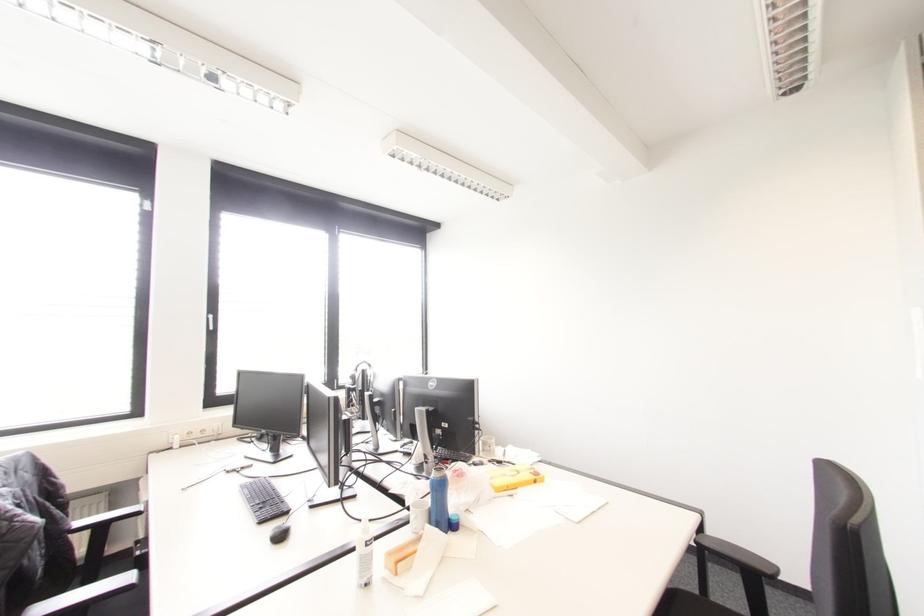
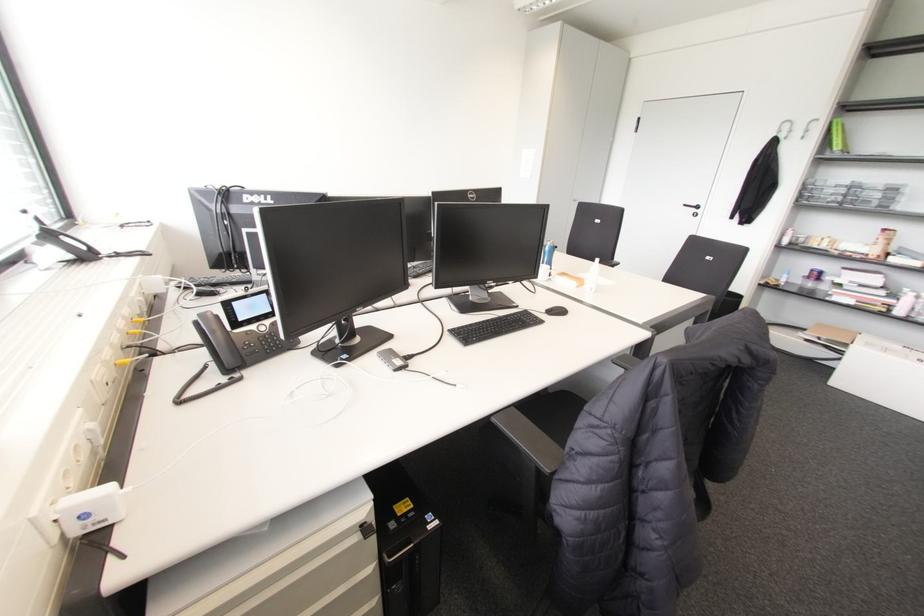
Question: I am providing you with two images of the same scene from different viewpoints. Please identify which objects are invisible in image2.

Choices:
 (A) brown and white mug
 (B) black chair armrest
 (C) black keyboard
 (D) black computer mouse

Answer: (B)